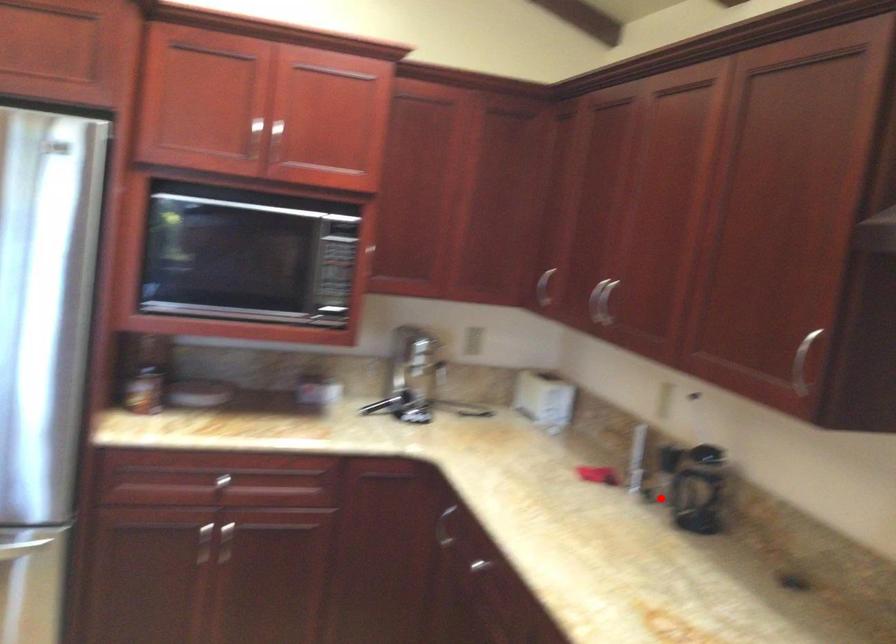
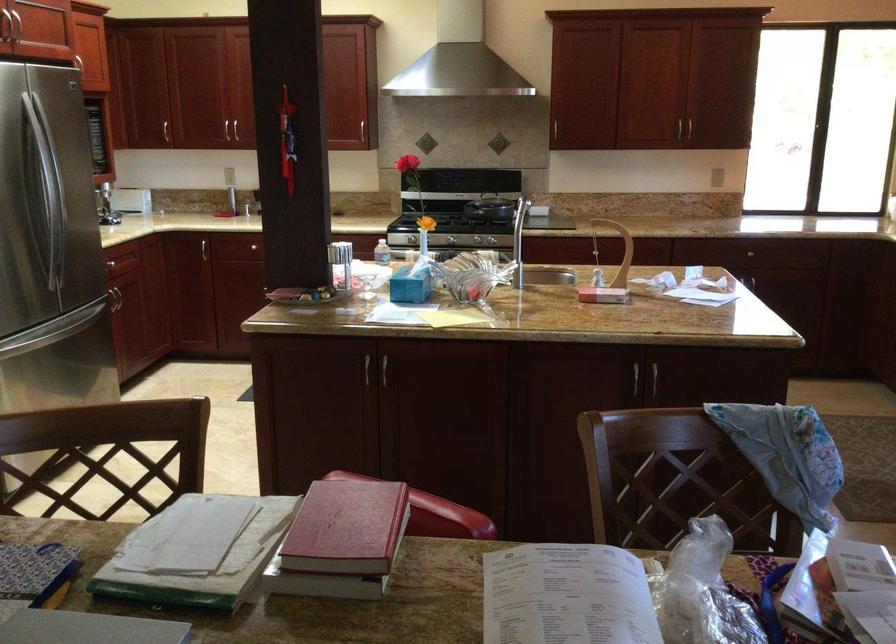
Question: I am providing you with two images of the same scene from different viewpoints. In image1, a red point is highlighted. Considering the same 3D point in image2, which of the following is correct?

Choices:
 (A) It is closer
 (B) It is farther

Answer: (B)